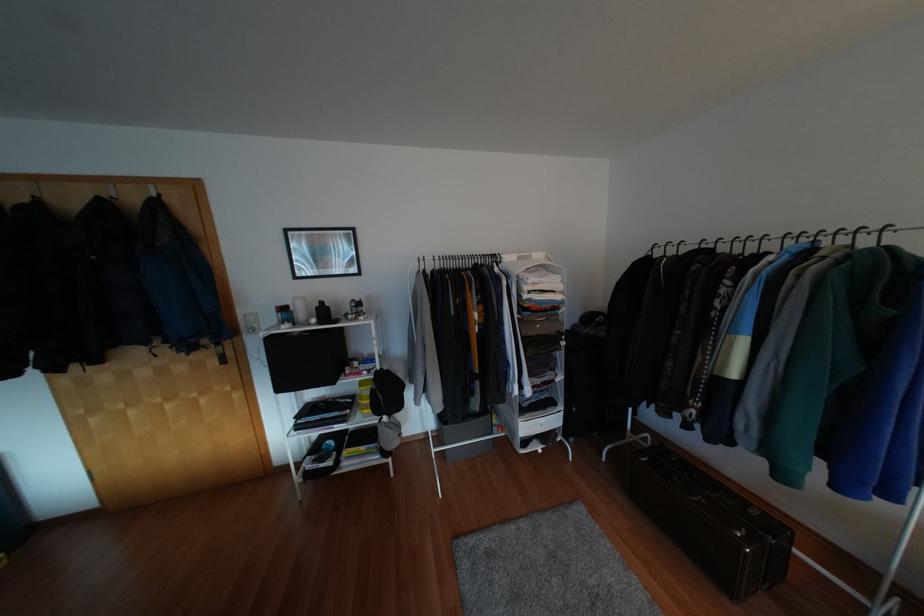
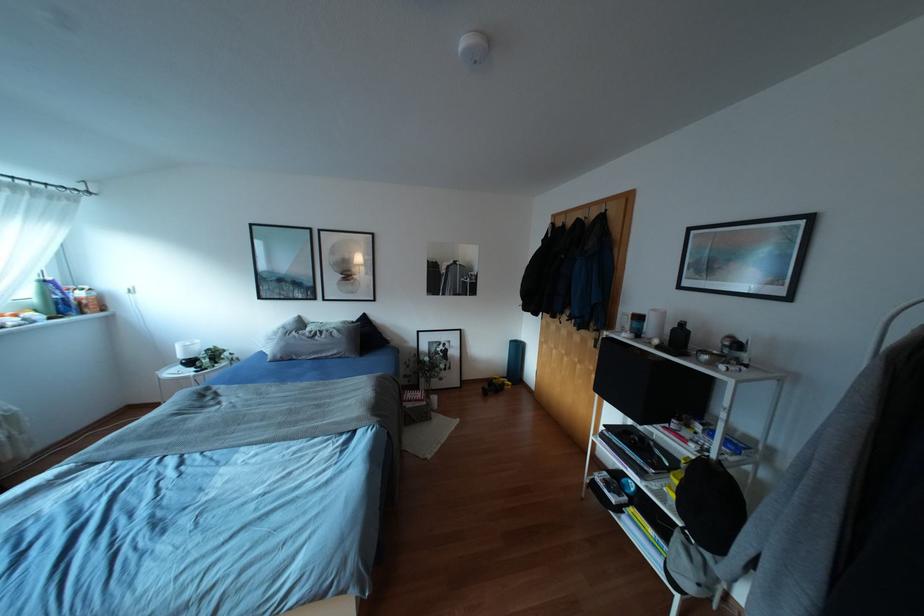
In the second image, find the point that corresponds to pixel 174 201 in the first image.

(612, 214)